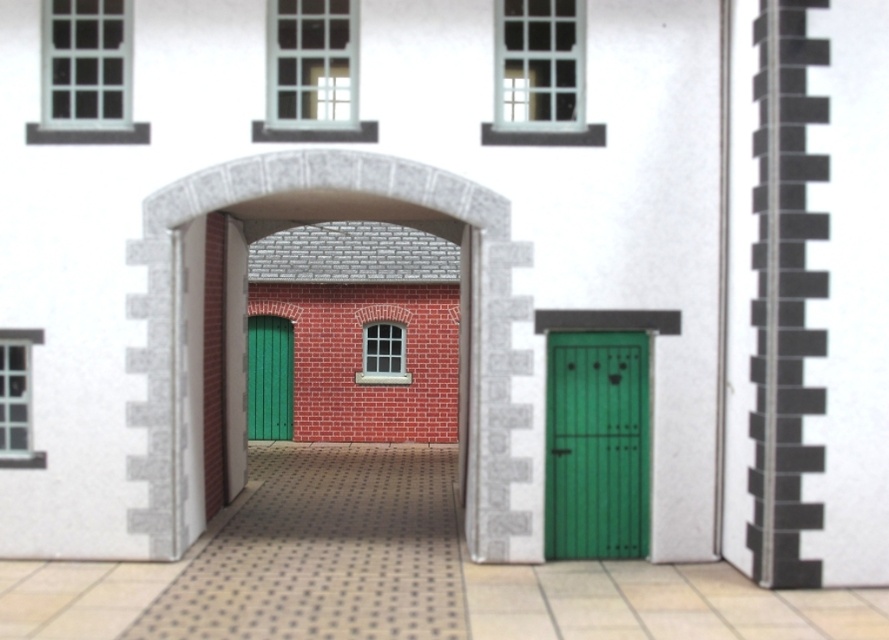
How distant is green matte door at right from green wooden door at center?

green matte door at right is 27.92 feet away from green wooden door at center.

Find the location of a particular element. The width and height of the screenshot is (889, 640). green matte door at right is located at coordinates (597, 445).

Locate an element on the screen. green matte door at right is located at coordinates (597, 445).

Is brick textured archway at center further to camera compared to green matte door at right?

No, brick textured archway at center is closer to the viewer.

Identify the location of brick textured archway at center. The image size is (889, 640). pos(310,221).

Which is more to the left, brick textured archway at center or green wooden door at center?

Positioned to the left is green wooden door at center.

This screenshot has width=889, height=640. I want to click on brick textured archway at center, so click(310, 221).

Where is `brick textured archway at center`? Image resolution: width=889 pixels, height=640 pixels. brick textured archway at center is located at coordinates (310, 221).